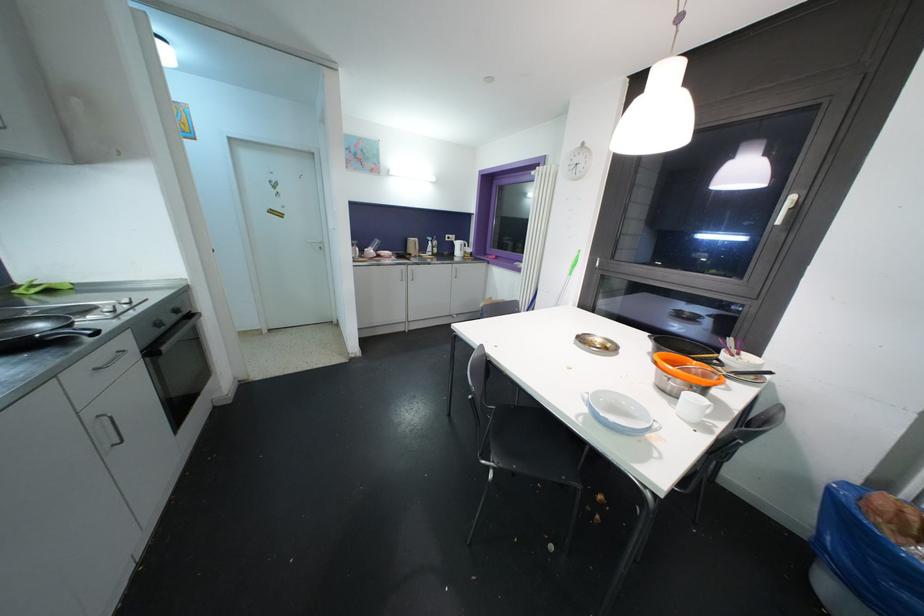
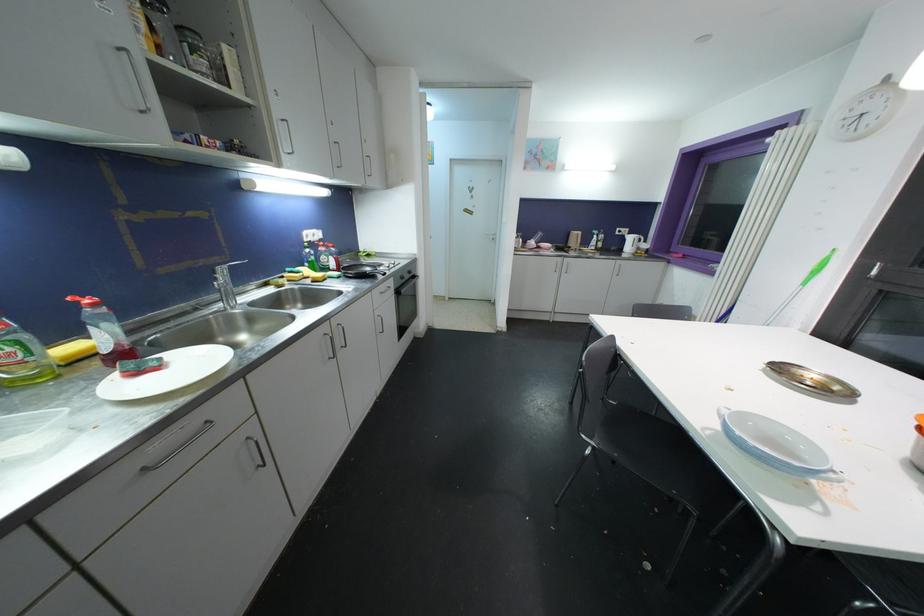
Where in the second image is the point corresponding to (x=91, y=421) from the first image?

(379, 318)